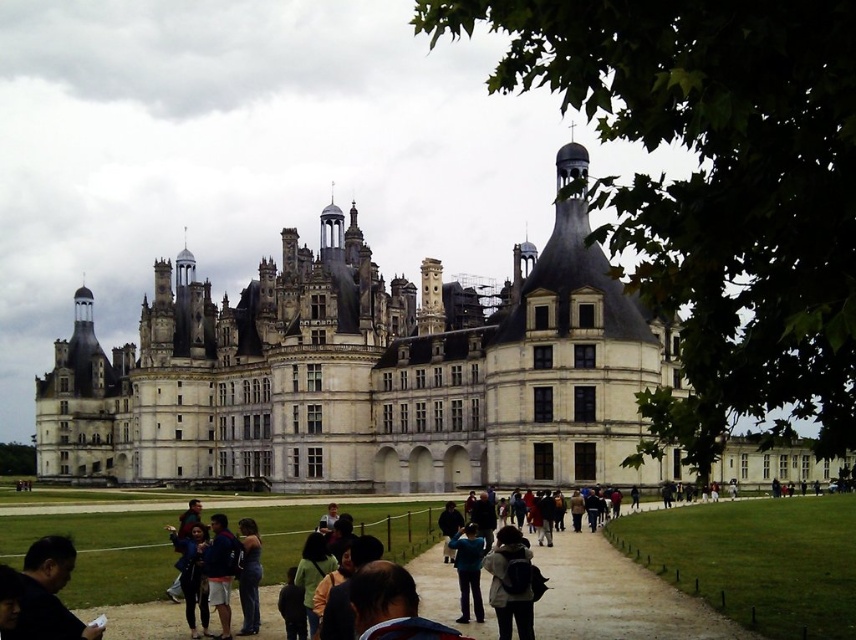
Question: Can you confirm if dark gray backpack at center is wider than dark blue jacket at center?

Choices:
 (A) yes
 (B) no

Answer: (A)

Question: Among these objects, which one is nearest to the camera?

Choices:
 (A) denim jacket at lower left
 (B) blue fabric jacket at center

Answer: (A)

Question: Which of the following is the farthest from the observer?

Choices:
 (A) dirt path at center
 (B) denim jacket at lower left
 (C) dark gray backpack at center
 (D) green fabric jacket at lower center

Answer: (B)

Question: Among these objects, which one is nearest to the camera?

Choices:
 (A) dark gray backpack at center
 (B) green fabric jacket at lower center

Answer: (A)

Question: Is white stone castle at center above dirt path at center?

Choices:
 (A) no
 (B) yes

Answer: (B)

Question: Is dark blue shirt at lower left to the right of dark gray backpack at center from the viewer's perspective?

Choices:
 (A) no
 (B) yes

Answer: (A)